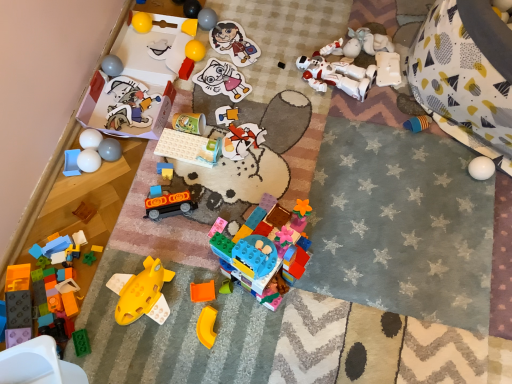
The width and height of the screenshot is (512, 384). I want to click on vacant space that is in between matte paper sticker at center, which appears as the 6th toy when viewed from the right, and white plastic robot at upper right, which appears as the second toy when viewed from the right, so click(x=284, y=84).